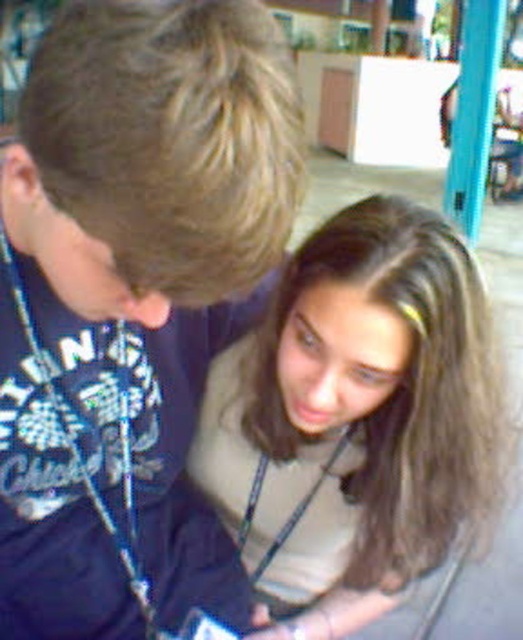
Does dark blue t-shirt at upper left have a greater height compared to brown hair at center?

Yes, dark blue t-shirt at upper left is taller than brown hair at center.

Who is taller, dark blue t-shirt at upper left or brown hair at center?

dark blue t-shirt at upper left is taller.

Between point (118, 49) and point (453, 244), which one is positioned behind?

The point (453, 244) is behind.

You are a GUI agent. You are given a task and a screenshot of the screen. Output one action in this format:
    pyautogui.click(x=<x>, y=<y>)
    Task: Click on the dark blue t-shirt at upper left
    
    Given the screenshot: What is the action you would take?
    pyautogui.click(x=132, y=300)